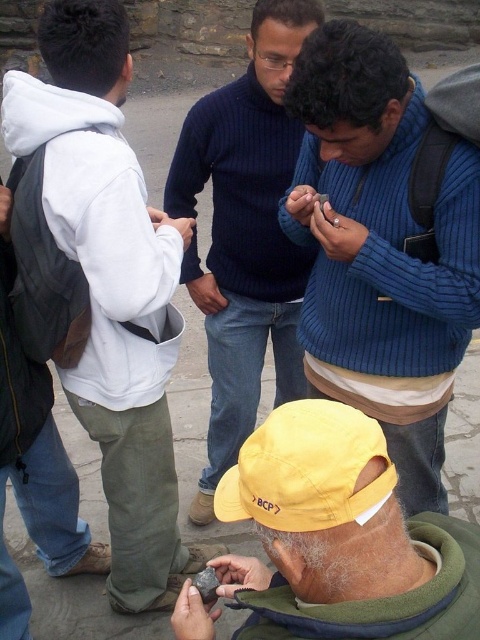
Consider the image. You are a photographer trying to capture a group photo of the yellow fabric cap at center and the dark blue sweater at center. Since you want to ensure both are visible in the frame, which object should you adjust the camera angle to focus on first to account for their size difference?

The yellow fabric cap at center has a lesser height compared to dark blue sweater at center, so you should focus on the dark blue sweater at center first to ensure it fits within the frame before adjusting for the smaller yellow fabric cap at center.

You are standing at the point labeled point (196,579) and want to walk to the point labeled point (9,401). Based on the scene description, will you be moving towards or away from the stone wall in the background?

Since point (9,401) is behind point (196,579), moving from point (196,579) to point (9,401) means you are moving towards the stone wall in the background.

You are standing at the origin point of the image coordinate system. The origin is at the bottom left corner of the image. The coordinates are normalized between 0 and 1. Which direction should you move to reach the dark blue sweater at center?

The dark blue sweater at center is located at coordinates point [244,234]. Since the origin is at the bottom left corner, you should move to the right by 0.366 and up by 0.510 to reach it.